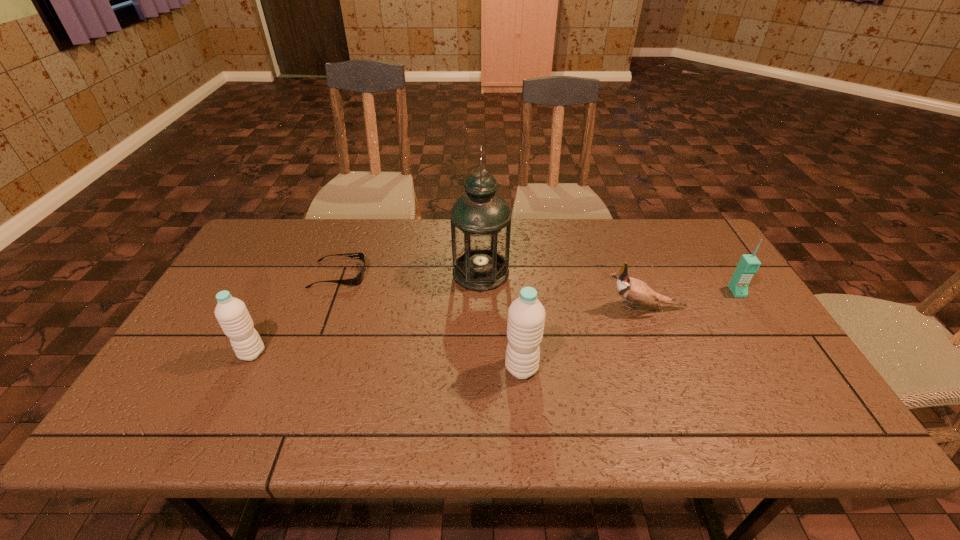
The width and height of the screenshot is (960, 540). I want to click on object present at the near edge, so click(526, 315).

Identify the location of object at the left edge. The image size is (960, 540). (231, 313).

At what (x,y) coordinates should I click in order to perform the action: click on object that is at the right edge. Please return your answer as a coordinate pair (x, y). Looking at the image, I should click on (749, 264).

This screenshot has width=960, height=540. Find the location of `free space at the far edge of the desktop`. free space at the far edge of the desktop is located at coordinates (588, 259).

In the image, there is a desktop. At what (x,y) coordinates should I click in order to perform the action: click on vacant region at the near edge. Please return your answer as a coordinate pair (x, y). Looking at the image, I should click on (385, 385).

Locate an element on the screen. This screenshot has width=960, height=540. free region at the left edge is located at coordinates (206, 332).

You are a GUI agent. You are given a task and a screenshot of the screen. Output one action in this format:
    pyautogui.click(x=<x>, y=<y>)
    Task: Click on the vacant region at the right edge of the desktop
    
    Given the screenshot: What is the action you would take?
    pyautogui.click(x=782, y=348)

You are a GUI agent. You are given a task and a screenshot of the screen. Output one action in this format:
    pyautogui.click(x=<x>, y=<y>)
    Task: Click on the vacant space at the far left corner of the desktop
    The image size is (960, 540).
    Given the screenshot: What is the action you would take?
    tap(293, 248)

Locate an element on the screen. vacant area at the far right corner is located at coordinates (694, 258).

This screenshot has height=540, width=960. In the image, there is a desktop. What are the coordinates of `vacant space at the near right corner` in the screenshot? It's located at (791, 373).